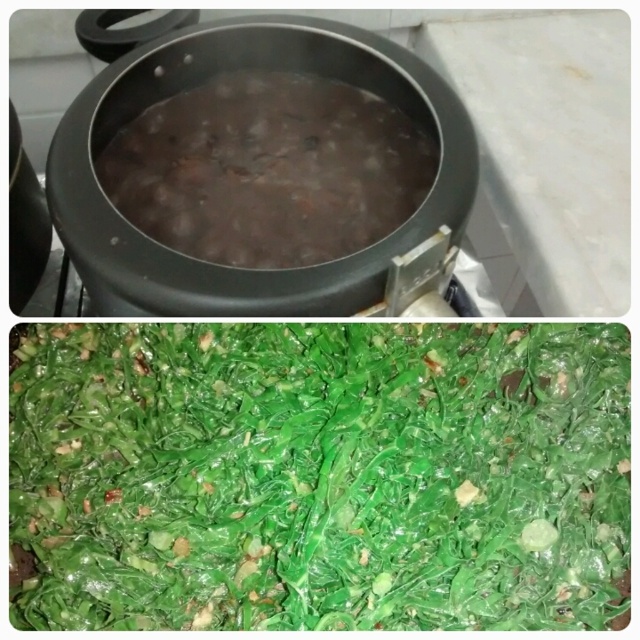
From the picture: Does glossy green leafy vegetable at center have a smaller size compared to brown matte beans at center?

Incorrect, glossy green leafy vegetable at center is not smaller in size than brown matte beans at center.

Describe the element at coordinates (321, 476) in the screenshot. The width and height of the screenshot is (640, 640). I see `glossy green leafy vegetable at center` at that location.

Find the location of a particular element. This screenshot has width=640, height=640. glossy green leafy vegetable at center is located at coordinates (321, 476).